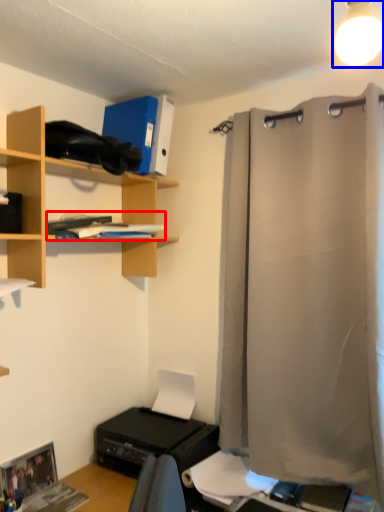
Question: Among these objects, which one is farthest to the camera, book (highlighted by a red box) or light fixture (highlighted by a blue box)?

Choices:
 (A) book
 (B) light fixture

Answer: (A)